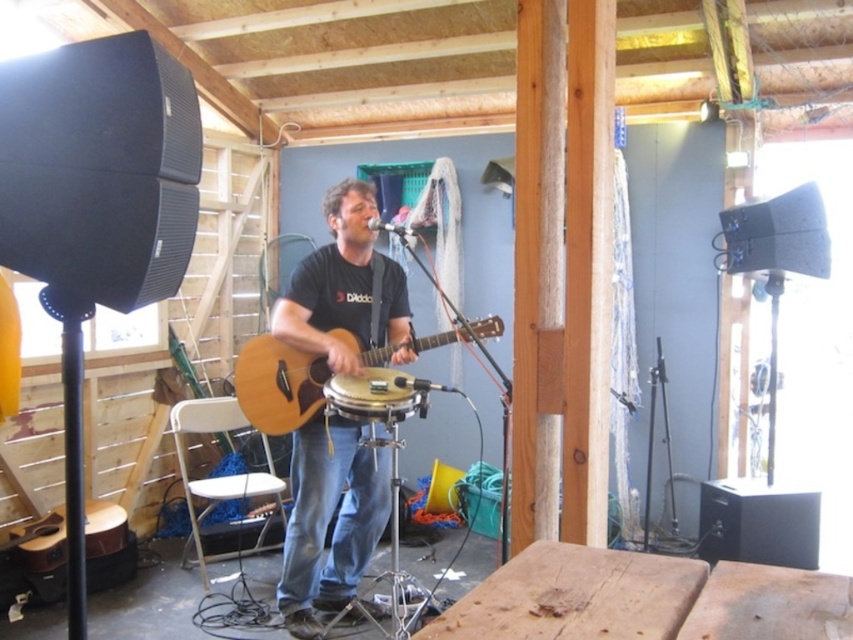
Question: Is natural wood acoustic guitar at center wider than matte black drum at center?

Choices:
 (A) yes
 (B) no

Answer: (A)

Question: Based on their relative distances, which object is nearer to the matte black drum at center?

Choices:
 (A) natural wood acoustic guitar at center
 (B) matte black guitar at center

Answer: (A)

Question: Is matte black guitar at center smaller than natural wood acoustic guitar at center?

Choices:
 (A) yes
 (B) no

Answer: (B)

Question: Which point appears farthest from the camera in this image?

Choices:
 (A) [x=271, y=388]
 (B) [x=292, y=568]
 (C) [x=381, y=420]

Answer: (B)

Question: Does matte black guitar at center have a greater width compared to matte black drum at center?

Choices:
 (A) no
 (B) yes

Answer: (B)

Question: Which of the following is the farthest from the observer?

Choices:
 (A) matte black drum at center
 (B) natural wood acoustic guitar at center

Answer: (B)